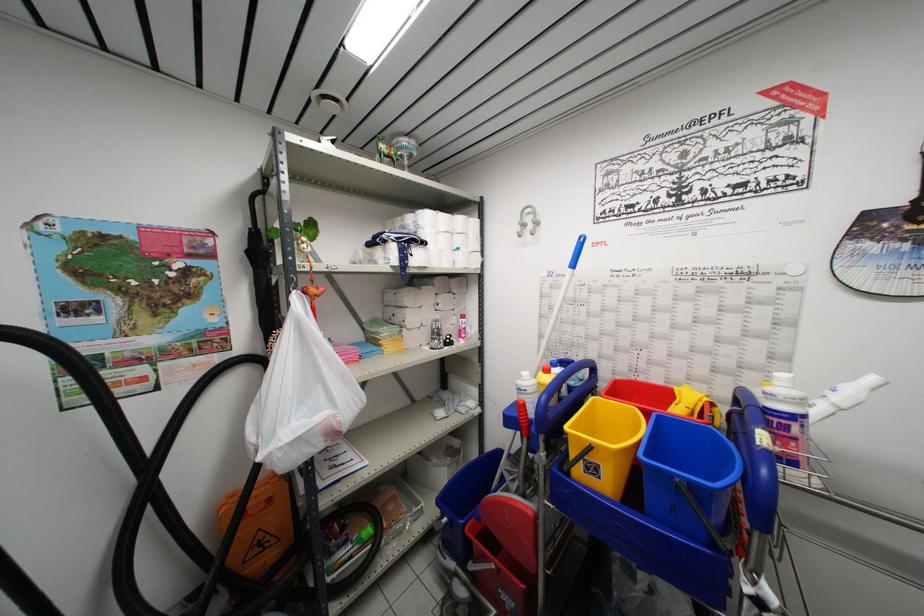
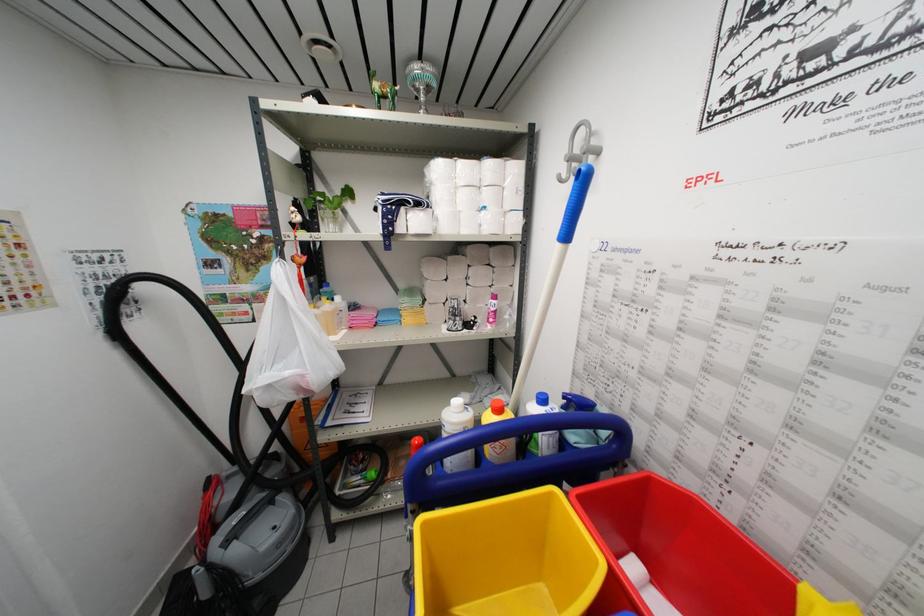
Question: The camera is either moving clockwise (left) or counter-clockwise (right) around the object. The first image is from the beginning of the video and the second image is from the end. Is the camera moving left or right when shooting the video?

Choices:
 (A) Left
 (B) Right

Answer: (B)